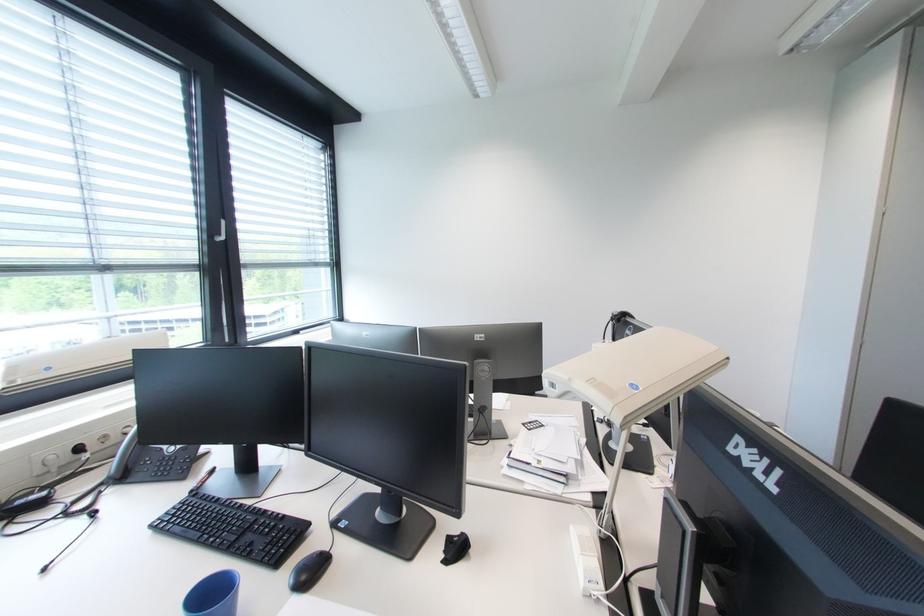
This screenshot has height=616, width=924. What are the coordinates of `red and black pen` in the screenshot? It's located at [x=202, y=480].